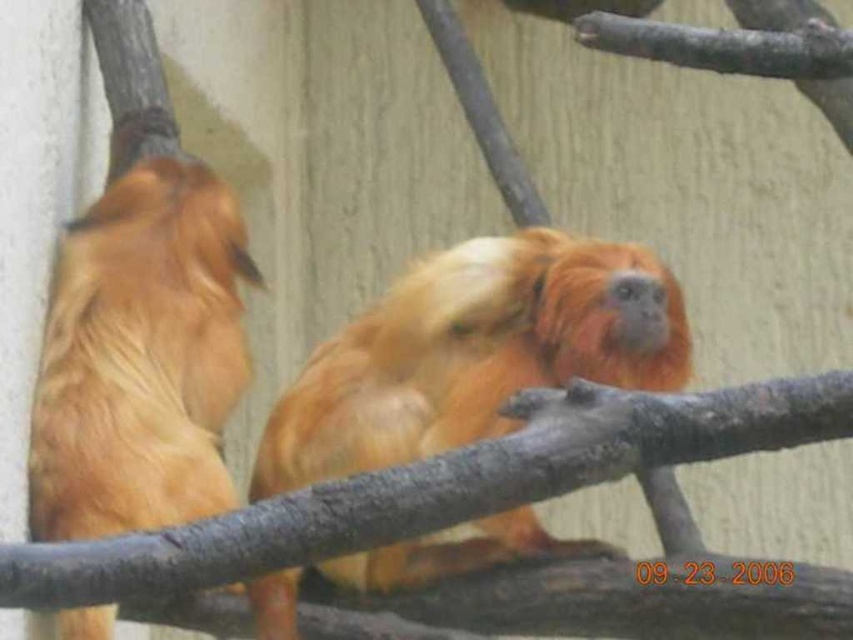
Does golden fur monkey at center have a lesser height compared to golden fur monkey at left?

Yes, golden fur monkey at center is shorter than golden fur monkey at left.

Can you confirm if golden fur monkey at center is bigger than golden fur monkey at left?

Yes.

Who is more distant from viewer, (598, 307) or (229, 483)?

The point (229, 483) is more distant.

You are a GUI agent. You are given a task and a screenshot of the screen. Output one action in this format:
    pyautogui.click(x=<x>, y=<y>)
    Task: Click on the golden fur monkey at center
    
    Given the screenshot: What is the action you would take?
    pyautogui.click(x=474, y=353)